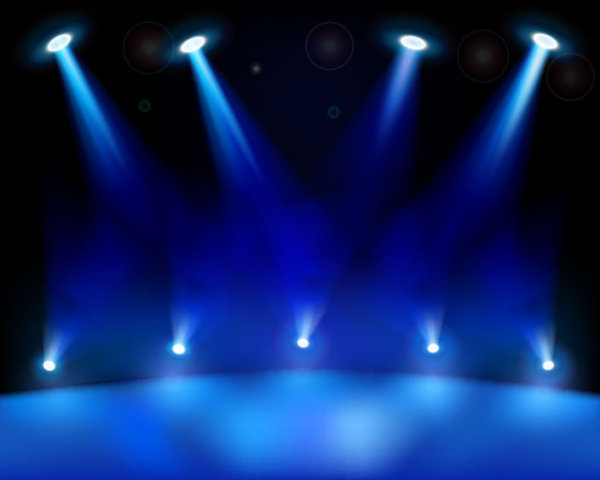
The height and width of the screenshot is (480, 600). In order to click on spotlights on bottom in this screenshot , I will do `click(53, 339)`, `click(185, 317)`, `click(309, 316)`, `click(422, 321)`, `click(533, 342)`.